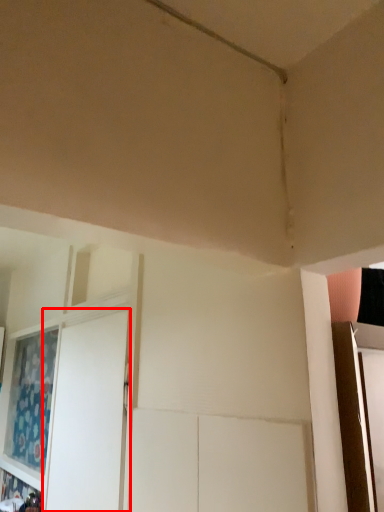
Question: From the image's perspective, what is the correct spatial positioning of screen door (annotated by the red box) in reference to curtain?

Choices:
 (A) below
 (B) above

Answer: (B)